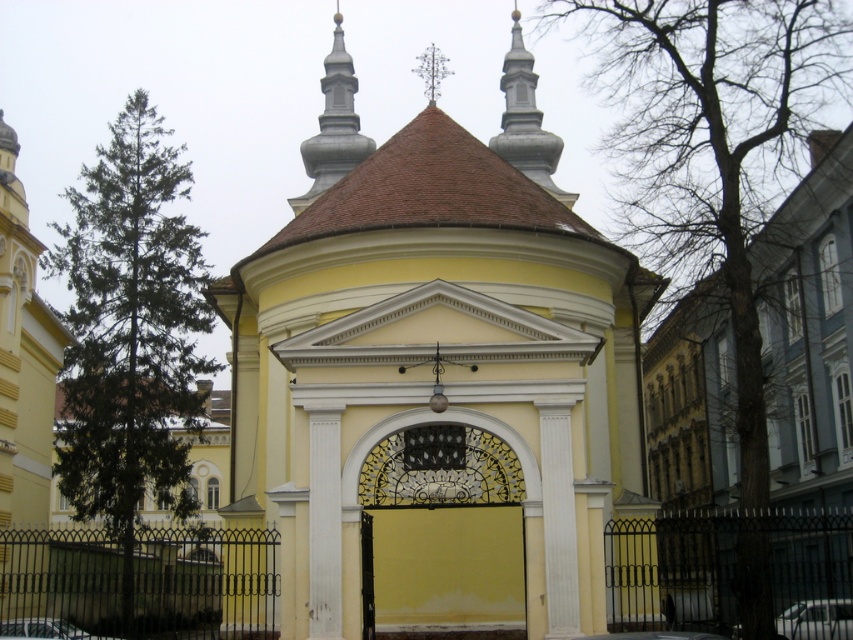
You are standing in front of the building and want to take a photo of the yellow matte wall at center. Based on its position, where should you aim your camera to capture it?

The yellow matte wall at center is located at point coordinates of 0.894 on the x axis and 0.526 on the y axis. To capture it, aim your camera towards the center of the building slightly to the right and lower portion of the frame.

You are standing in a park and see the yellow matte wall at center of a historic building. If you want to take a photo of it from a closer distance, would you need to move forward or backward?

The yellow matte wall at center is 61.38 meters away from the viewer. To take a closer photo, you would need to move forward towards the wall.

You are standing in front of the building and want to enter through the entrance. Which object, the yellow matte wall at center or the wrought iron gate at center, is closer to you as you approach the building?

The wrought iron gate at center is closer to you because the yellow matte wall at center is below it, meaning the gate is positioned in front of the wall near the entrance.